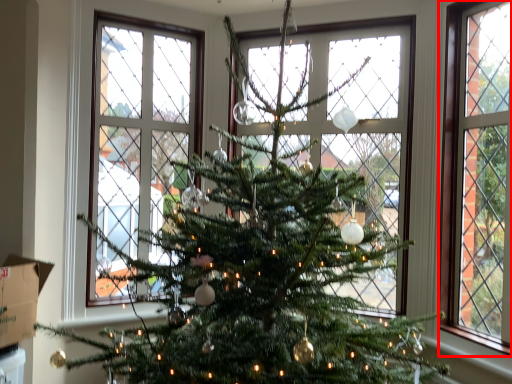
Question: From the image's perspective, what is the correct spatial positioning of window (annotated by the red box) in reference to cardboard box?

Choices:
 (A) below
 (B) above

Answer: (B)